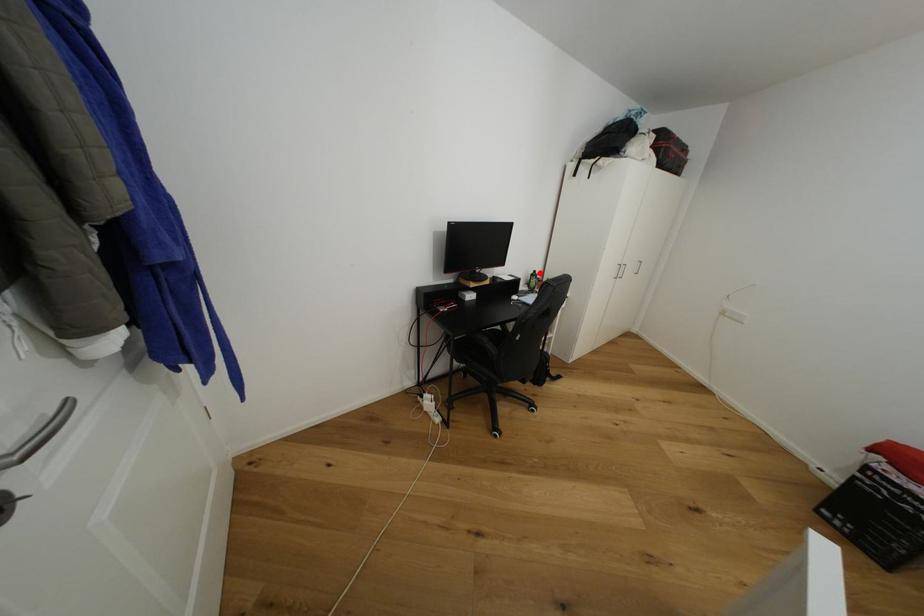
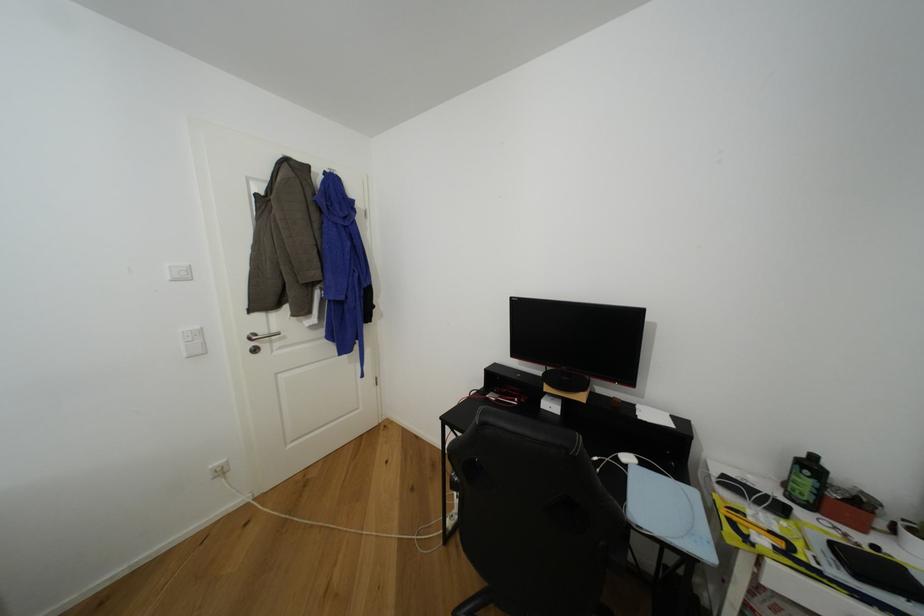
Locate, in the second image, the point that corresponds to the highlighted location in the first image.

(820, 459)